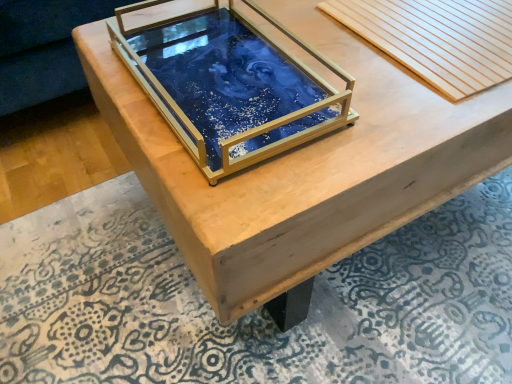
Find the location of a particular element. This screenshot has height=384, width=512. free spot above blue resin tray at center (from a real-world perspective) is located at coordinates (282, 300).